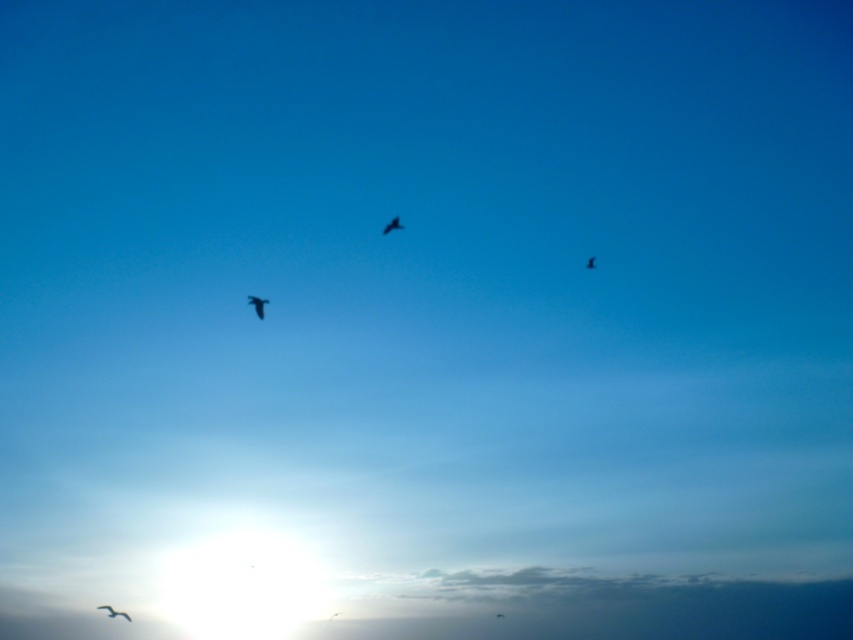
Between black feathered bird at center and black matte bird at upper center, which one has less height?

black feathered bird at center is shorter.

Is black feathered bird at center further to the viewer compared to black matte bird at upper center?

No, black feathered bird at center is closer to the viewer.

Who is more forward, (x=393, y=225) or (x=589, y=257)?

Positioned in front is point (x=393, y=225).

I want to click on black feathered bird at center, so click(392, 225).

Does point (105, 604) come farther from viewer compared to point (589, 257)?

Yes, it is.

Is silhouette feathered bird at lower left to the right of black matte bird at upper center from the viewer's perspective?

In fact, silhouette feathered bird at lower left is to the left of black matte bird at upper center.

Describe the element at coordinates (113, 612) in the screenshot. This screenshot has height=640, width=853. I see `silhouette feathered bird at lower left` at that location.

At what (x,y) coordinates should I click in order to perform the action: click on silhouette feathered bird at lower left. Please return your answer as a coordinate pair (x, y). The height and width of the screenshot is (640, 853). Looking at the image, I should click on (113, 612).

Is silhouette feathered bird at center thinner than silhouette feathered bird at lower left?

Yes, silhouette feathered bird at center is thinner than silhouette feathered bird at lower left.

Does point (248, 301) lie in front of point (109, 608)?

Yes, it is.

Is point (263, 316) closer to camera compared to point (117, 612)?

Yes, point (263, 316) is closer to viewer.

This screenshot has width=853, height=640. In order to click on silhouette feathered bird at center in this screenshot , I will do `click(257, 305)`.